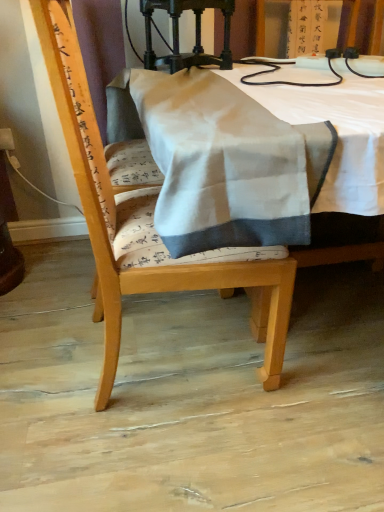
At what (x,y) coordinates should I click in order to perform the action: click on vacant space to the right of wooden chair at center. Please return your answer as a coordinate pair (x, y). Looking at the image, I should click on (319, 374).